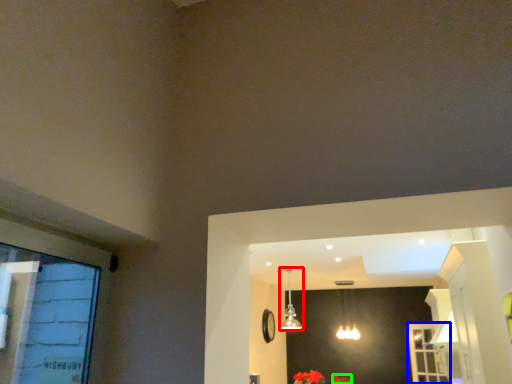
Question: Which object is positioned closest to lamp (highlighted by a red box)? Select from screen door (highlighted by a blue box) and flower (highlighted by a green box).

Choices:
 (A) screen door
 (B) flower

Answer: (B)